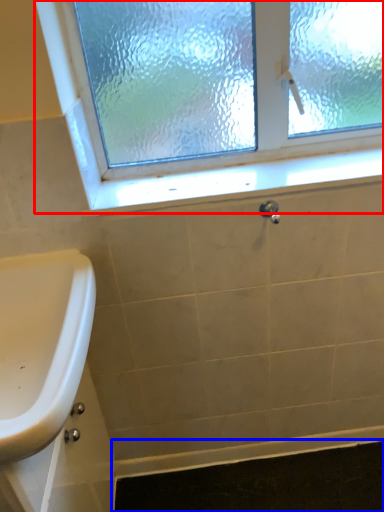
Question: Which point is further to the camera, window (highlighted by a red box) or bath mat (highlighted by a blue box)?

Choices:
 (A) window
 (B) bath mat

Answer: (B)